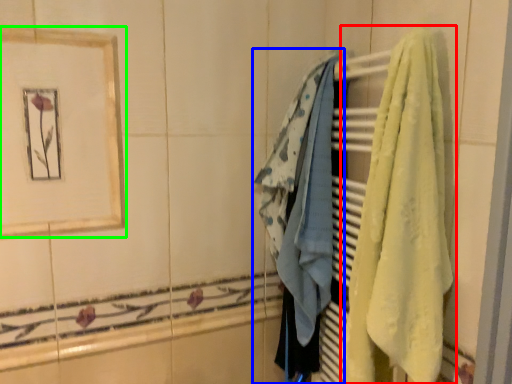
Question: Which object is the closest to the towel (highlighted by a red box)? Choose among these: towel (highlighted by a blue box) or picture frame (highlighted by a green box).

Choices:
 (A) towel
 (B) picture frame

Answer: (A)